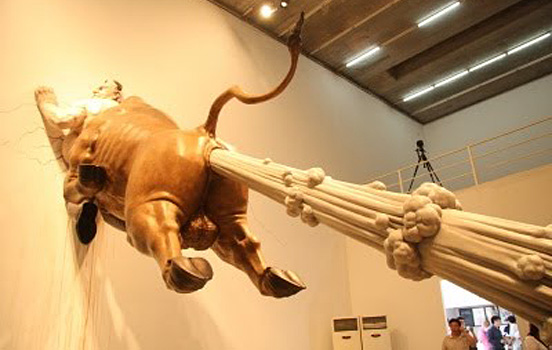
The height and width of the screenshot is (350, 552). Find the location of `wall`. wall is located at coordinates (511, 110), (46, 232).